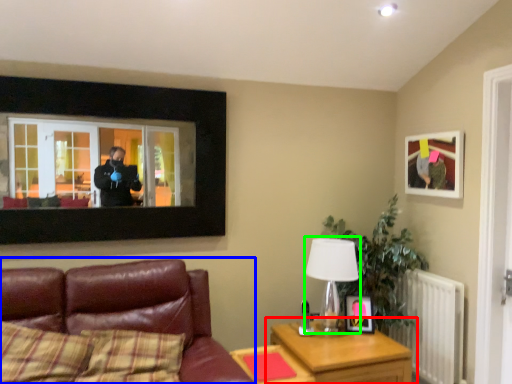
Question: Which object is the closest to the table (highlighted by a red box)? Choose among these: studio couch (highlighted by a blue box) or table lamp (highlighted by a green box).

Choices:
 (A) studio couch
 (B) table lamp

Answer: (B)